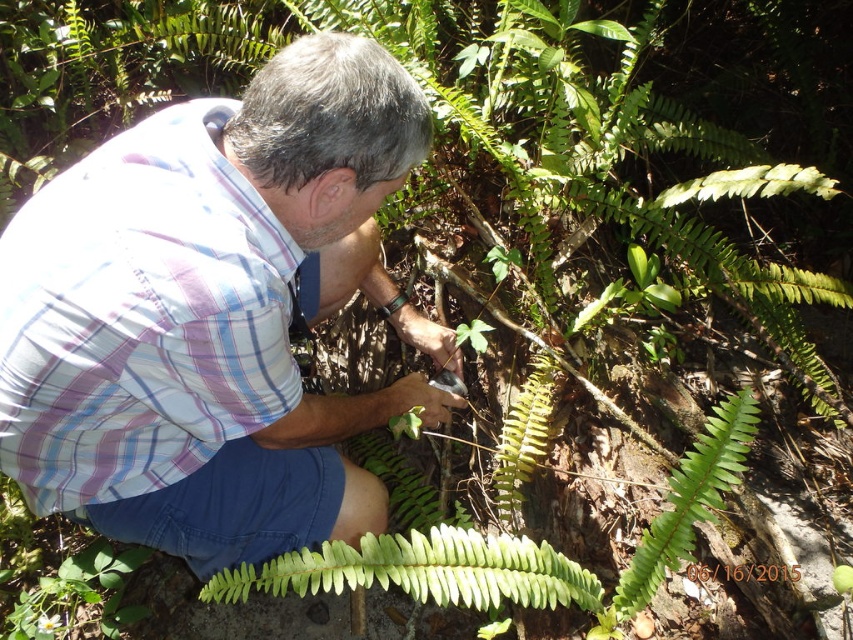
Question: In this image, where is plaid fabric shirt at center located relative to green leafy fern at center?

Choices:
 (A) above
 (B) below

Answer: (A)

Question: Which object appears closest to the camera in this image?

Choices:
 (A) green leafy fern at center
 (B) plaid fabric shirt at center

Answer: (B)

Question: Is plaid fabric shirt at center above green leafy fern at center?

Choices:
 (A) no
 (B) yes

Answer: (B)

Question: Can you confirm if plaid fabric shirt at center is wider than green leafy fern at center?

Choices:
 (A) yes
 (B) no

Answer: (B)